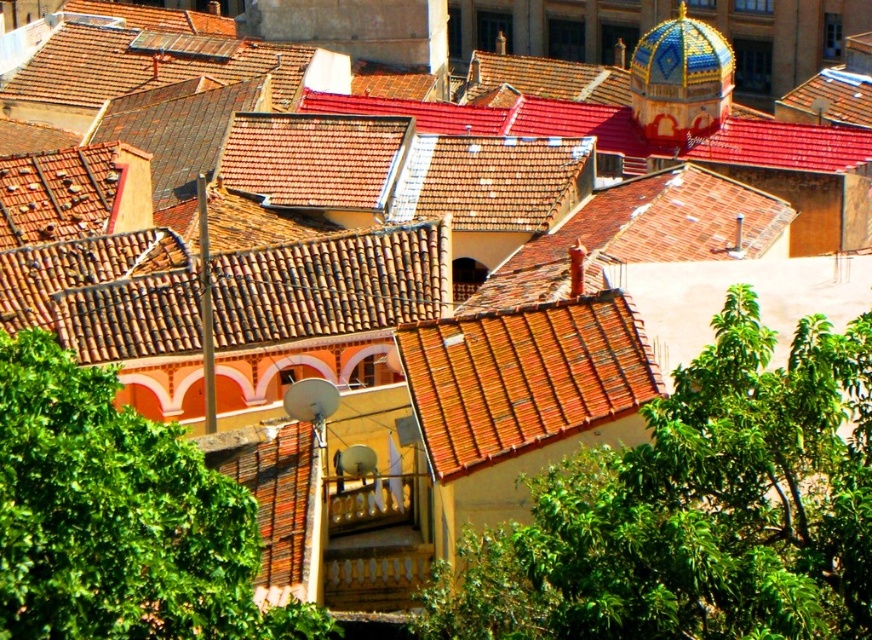
You are standing on the rooftop and see the green leafy tree at center and the green leafy tree at lower left. Which tree is located to the right of the other?

The green leafy tree at center is positioned on the right side of the green leafy tree at lower left.

You are a drone operator trying to navigate through a narrow alley between two buildings in the rooftop scene. Your drone has a wingspan of 0.2 meters. There is a green leafy tree at lower left located at point (118,516). Can your drone safely pass through the space between the buildings without hitting the tree?

The green leafy tree at lower left is located at point (118,516). Since the tree is at that specific coordinate, the drone must avoid it. However, the description does not provide information about the distance between the buildings or the space available for the drone to navigate around the tree. Without this information, it is impossible to determine if the drone can safely pass through the space between the buildings without hitting the tree.

You are standing on the rooftop and want to take a photo of both the point at coordinates (x=763, y=403) and the point at coordinates (x=697, y=97). Which point should you focus on first to ensure both are in sharp focus?

You should focus on point (x=697, y=97) first because it is farther from the camera than point (x=763, y=403). By focusing on the farther point, the closer point will also be within the depth of field, ensuring both are in sharp focus.